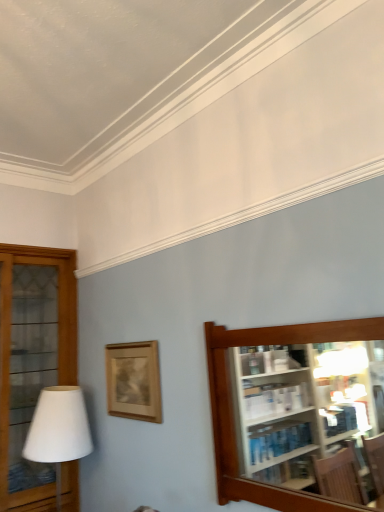
Question: Considering the relative sizes of wooden picture frame at center and wooden glass cabinet at left, the second shelf from the right, in the image provided, is wooden picture frame at center shorter than wooden glass cabinet at left, the second shelf from the right,?

Choices:
 (A) yes
 (B) no

Answer: (A)

Question: Is wooden picture frame at center facing towards wooden glass cabinet at left, placed as the 2th shelf when sorted from front to back?

Choices:
 (A) yes
 (B) no

Answer: (B)

Question: Can you confirm if wooden picture frame at center is smaller than wooden glass cabinet at left, the second shelf from the right?

Choices:
 (A) no
 (B) yes

Answer: (B)

Question: Is wooden picture frame at center outside wooden glass cabinet at left, the second shelf from the right?

Choices:
 (A) no
 (B) yes

Answer: (B)

Question: Is wooden picture frame at center taller than wooden glass cabinet at left, acting as the first shelf starting from the back?

Choices:
 (A) no
 (B) yes

Answer: (A)

Question: From the image's perspective, is wooden picture frame at center beneath wooden glass cabinet at left, positioned as the 1th shelf in left-to-right order?

Choices:
 (A) yes
 (B) no

Answer: (B)

Question: Considering the relative positions of brown wooden shelf at right, which appears as the 2th shelf when viewed from the left, and white matte table lamp at left in the image provided, is brown wooden shelf at right, which appears as the 2th shelf when viewed from the left, to the left of white matte table lamp at left from the viewer's perspective?

Choices:
 (A) no
 (B) yes

Answer: (A)

Question: Considering the relative sizes of brown wooden shelf at right, acting as the first shelf starting from the front, and white matte table lamp at left in the image provided, is brown wooden shelf at right, acting as the first shelf starting from the front, smaller than white matte table lamp at left?

Choices:
 (A) yes
 (B) no

Answer: (A)

Question: Can you confirm if brown wooden shelf at right, acting as the first shelf starting from the front, is taller than white matte table lamp at left?

Choices:
 (A) no
 (B) yes

Answer: (A)

Question: Are brown wooden shelf at right, marked as the second shelf in a back-to-front arrangement, and white matte table lamp at left making contact?

Choices:
 (A) yes
 (B) no

Answer: (B)

Question: Is white matte table lamp at left at the back of brown wooden shelf at right, which appears as the 2th shelf when viewed from the left?

Choices:
 (A) no
 (B) yes

Answer: (A)

Question: Can you confirm if wooden glass cabinet at left, placed as the 2th shelf when sorted from front to back, is smaller than wooden picture frame at center?

Choices:
 (A) yes
 (B) no

Answer: (B)